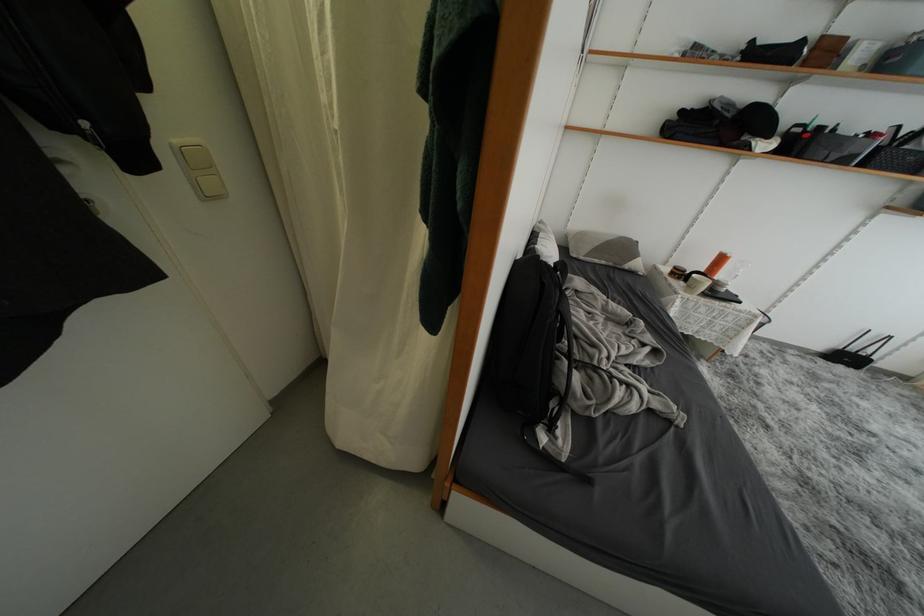
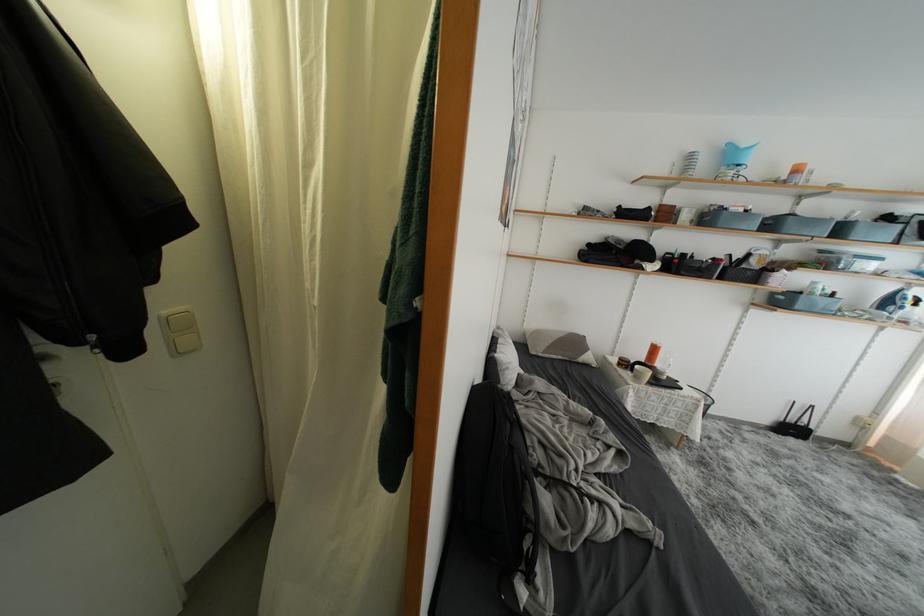
Find the pixel in the second image that matches the point at 697,292 in the first image.

(642, 382)